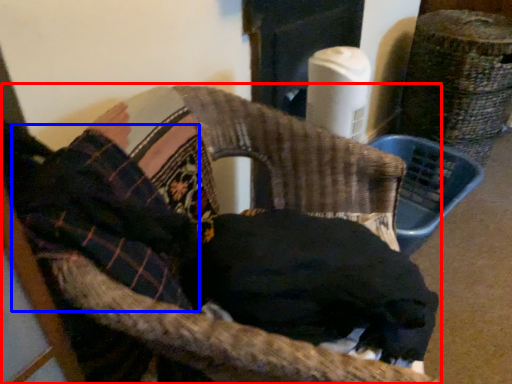
Question: Among these objects, which one is nearest to the camera, chair (highlighted by a red box) or clothing (highlighted by a blue box)?

Choices:
 (A) chair
 (B) clothing

Answer: (A)